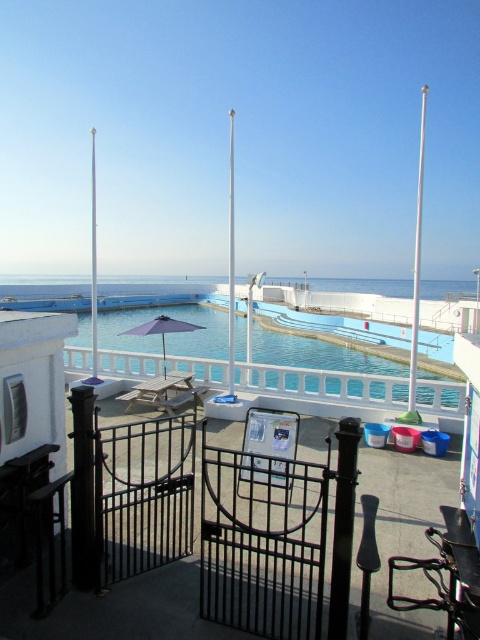
Does blue glass water at center have a smaller size compared to purple fabric umbrella at center?

Incorrect, blue glass water at center is not smaller in size than purple fabric umbrella at center.

Looking at this image, is blue glass water at center positioned in front of purple fabric umbrella at center?

Yes, blue glass water at center is in front of purple fabric umbrella at center.

Does point (154, 340) come in front of point (148, 323)?

No.

The width and height of the screenshot is (480, 640). In order to click on blue glass water at center in this screenshot , I will do `click(324, 380)`.

Is white metallic pole at upper center below white glossy pole at center?

No, white metallic pole at upper center is not below white glossy pole at center.

Does white metallic pole at upper center have a greater width compared to white glossy pole at center?

In fact, white metallic pole at upper center might be narrower than white glossy pole at center.

Measure the distance between point [231,156] and camera.

A distance of 426.83 feet exists between point [231,156] and camera.

At what (x,y) coordinates should I click in order to perform the action: click on white metallic pole at upper center. Please return your answer as a coordinate pair (x, y). Image resolution: width=480 pixels, height=640 pixels. Looking at the image, I should click on (230, 266).

Does white glossy pole at center have a greater width compared to purple fabric umbrella at center?

Correct, the width of white glossy pole at center exceeds that of purple fabric umbrella at center.

Is white glossy pole at center below purple fabric umbrella at center?

No, white glossy pole at center is not below purple fabric umbrella at center.

Is point (94, 326) behind point (152, 323)?

Yes, it is.

Where is `white glossy pole at center`? Image resolution: width=480 pixels, height=640 pixels. white glossy pole at center is located at coordinates (94, 266).